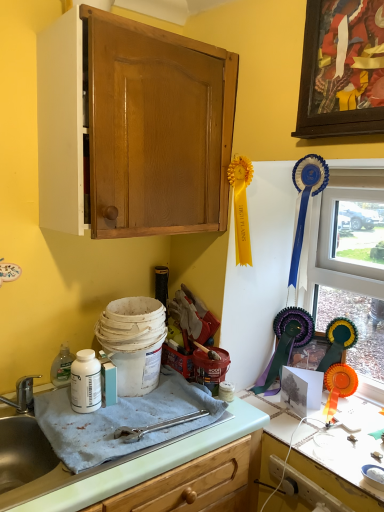
Locate an element on the screen. The image size is (384, 512). vacant area that is situated to the right of white matte bottle at lower left is located at coordinates (140, 420).